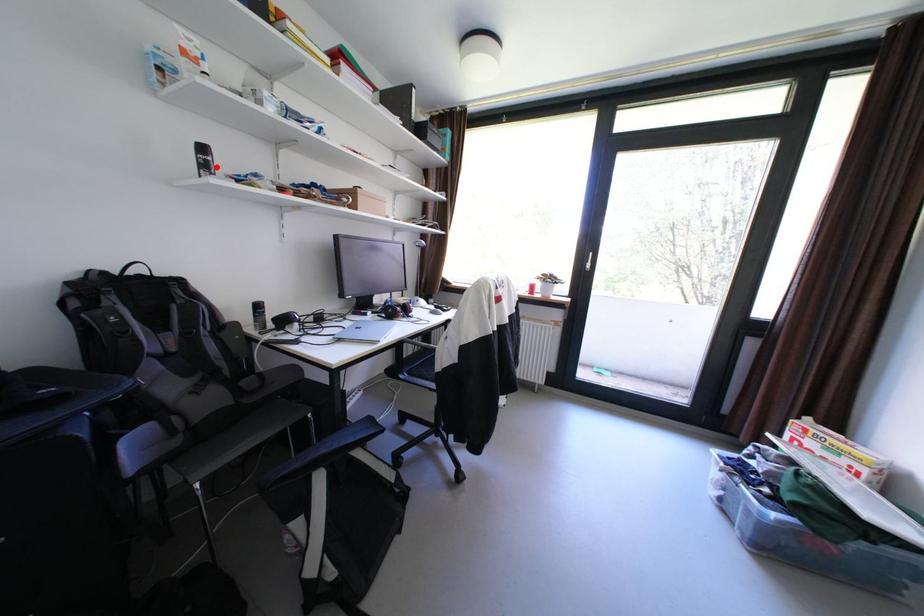
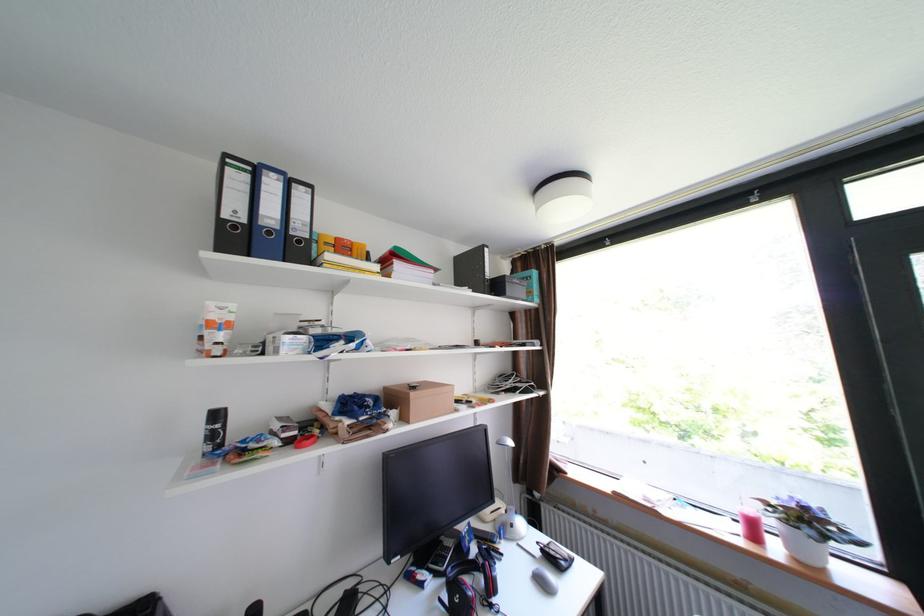
Locate, in the second image, the point that corresponds to the highlighted location in the first image.

(225, 436)